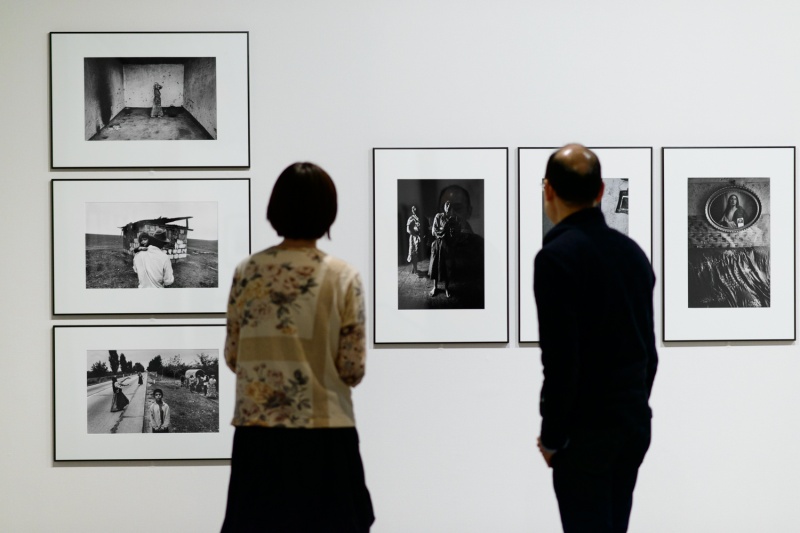
Find the location of a particular element. Image resolution: width=800 pixels, height=533 pixels. wall is located at coordinates (550, 60), (728, 440), (450, 419), (22, 435), (25, 100).